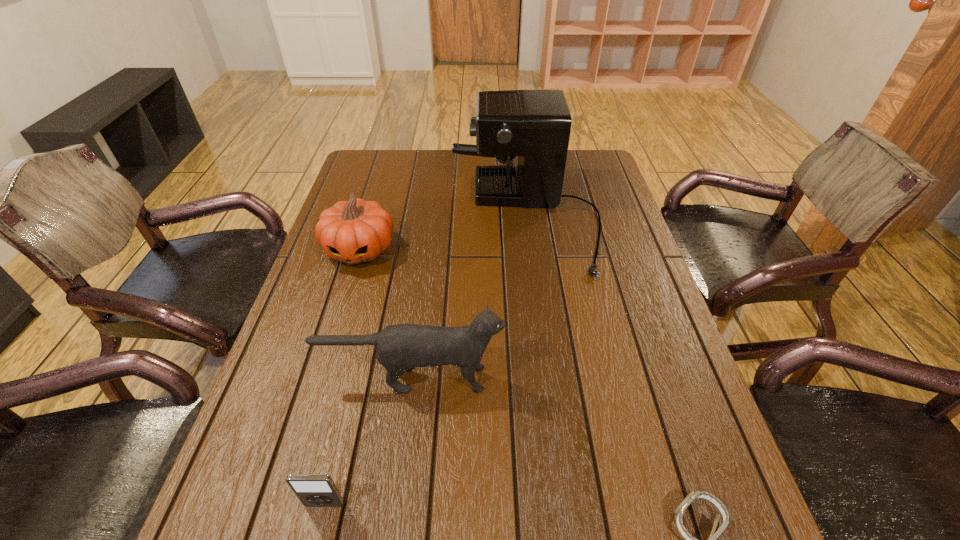
This screenshot has height=540, width=960. I want to click on free spot between the second tallest object and the tallest object, so click(468, 299).

Identify the location of free space between the cat and the iPod. The image size is (960, 540). (369, 441).

What are the coordinates of `unoccupied position between the second shortest object and the third shortest object` in the screenshot? It's located at [342, 377].

The height and width of the screenshot is (540, 960). I want to click on vacant space that is in between the third farthest object and the iPod, so click(x=369, y=441).

Find the location of `empty space that is in between the iPod and the third nearest object`. empty space that is in between the iPod and the third nearest object is located at coordinates (369, 441).

Find the location of `empty space between the iPod and the cat`. empty space between the iPod and the cat is located at coordinates (369, 441).

At what (x,y) coordinates should I click in order to perform the action: click on object that is the second closest one to the second shortest object. Please return your answer as a coordinate pair (x, y). This screenshot has height=540, width=960. Looking at the image, I should click on (717, 529).

Choose which object is the third nearest neighbor to the fourth tallest object. Please provide its 2D coordinates. Your answer should be formatted as a tuple, i.e. [(x, y)], where the tuple contains the x and y coordinates of a point satisfying the conditions above.

[(355, 231)]

At what (x,y) coordinates should I click in order to perform the action: click on free point that satisfies the following two spatial constraints: 1. on the front-facing side of the tallest object; 2. on the face of the pumpkin. Please return your answer as a coordinate pair (x, y). Looking at the image, I should click on (529, 250).

The width and height of the screenshot is (960, 540). What are the coordinates of `free space that satisfies the following two spatial constraints: 1. on the front-facing side of the fourth shortest object; 2. on the front-facing side of the iPod` in the screenshot? It's located at (396, 504).